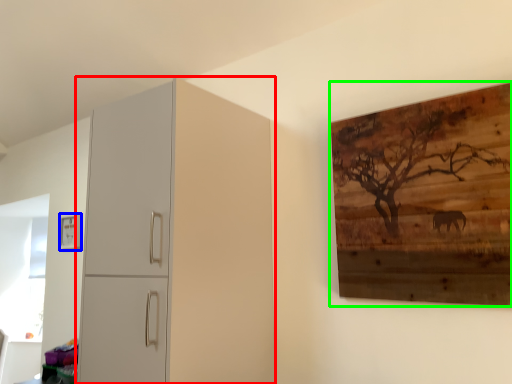
Question: Estimate the real-world distances between objects in this image. Which object is closer to cupboard (highlighted by a red box), picture frame (highlighted by a blue box) or picture frame (highlighted by a green box)?

Choices:
 (A) picture frame
 (B) picture frame

Answer: (B)